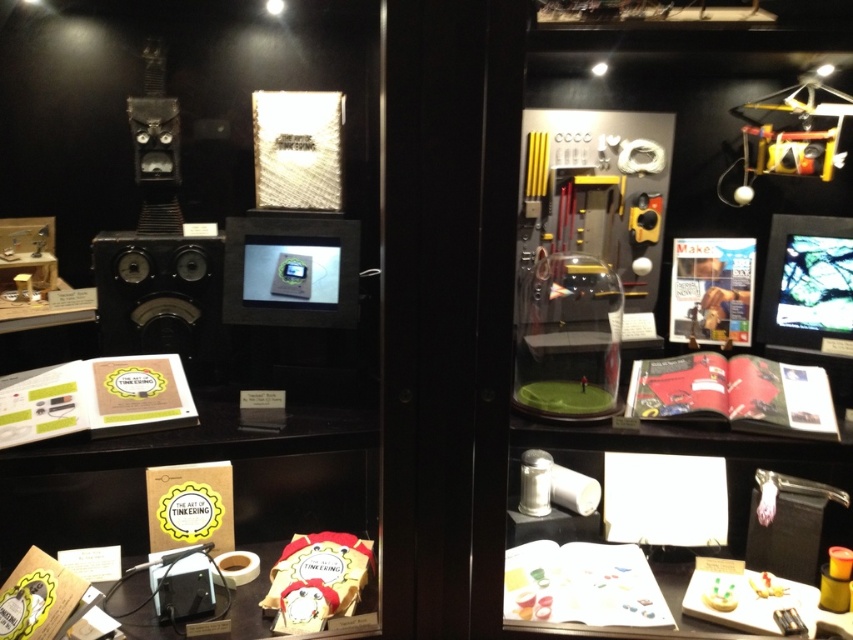
Question: Is matte black speaker at left further to the viewer compared to metallic yellow helicopter at upper right?

Choices:
 (A) yes
 (B) no

Answer: (B)

Question: Which point is closer to the camera taking this photo?

Choices:
 (A) (820, 156)
 (B) (549, 424)

Answer: (B)

Question: Does matte black speaker at left have a greater width compared to metallic yellow helicopter at upper right?

Choices:
 (A) yes
 (B) no

Answer: (A)

Question: Which point is closer to the camera?

Choices:
 (A) (500, 106)
 (B) (140, 292)

Answer: (A)

Question: Is matte black speaker at left further to camera compared to metallic yellow helicopter at upper right?

Choices:
 (A) no
 (B) yes

Answer: (A)

Question: Which of the following is the closest to the observer?

Choices:
 (A) (846, 100)
 (B) (155, 296)
 (C) (695, 451)

Answer: (C)